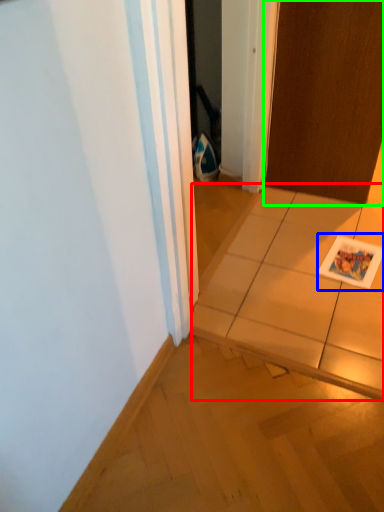
Question: Which object is the farthest from tile (highlighted by a red box)? Choose among these: postcard (highlighted by a blue box) or door (highlighted by a green box).

Choices:
 (A) postcard
 (B) door

Answer: (B)